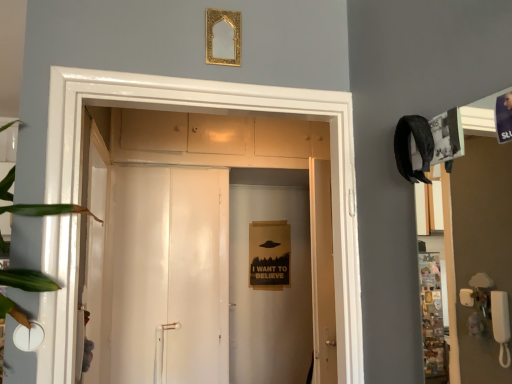
Question: Is green leafy plant at left taller or shorter than white glossy door at center?

Choices:
 (A) tall
 (B) short

Answer: (B)

Question: From a real-world perspective, is green leafy plant at left positioned above or below white glossy door at center?

Choices:
 (A) above
 (B) below

Answer: (A)

Question: Considering the real-world distances, which object is closest to the white glossy door at center?

Choices:
 (A) green leafy plant at left
 (B) gold ornate mirror at upper center

Answer: (B)

Question: Which of these objects is positioned closest to the white glossy door at center?

Choices:
 (A) gold ornate mirror at upper center
 (B) green leafy plant at left

Answer: (A)